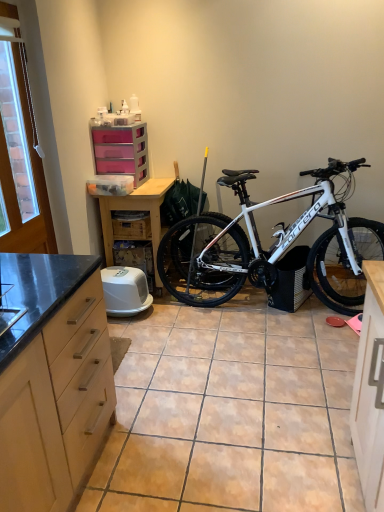
Question: In the image, is wooden crate at center on the left side or the right side of white plastic litter box at center?

Choices:
 (A) left
 (B) right

Answer: (B)

Question: Considering the positions of point (139, 218) and point (142, 306), is point (139, 218) closer or farther from the camera than point (142, 306)?

Choices:
 (A) farther
 (B) closer

Answer: (A)

Question: Which of these objects is positioned closest to the white matte bicycle at center-right?

Choices:
 (A) brown tile at center
 (B) wooden crate at center
 (C) matte wood cabinet at left
 (D) wooden table at center
 (E) white plastic litter box at center

Answer: (A)

Question: Based on their relative distances, which object is nearer to the white plastic chain at upper left?

Choices:
 (A) wooden table at center
 (B) wooden crate at center
 (C) matte wood cabinet at left
 (D) white matte bicycle at center-right
 (E) brown tile at center

Answer: (A)